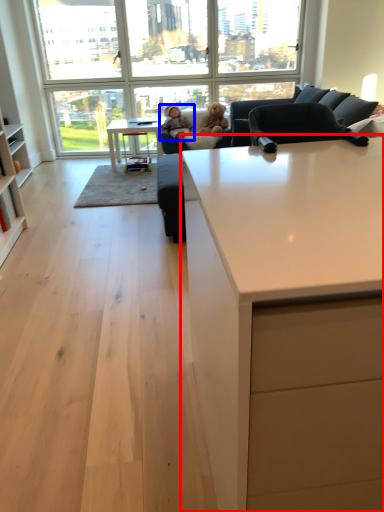
Question: Which object appears farthest to the camera in this image, countertop (highlighted by a red box) or person (highlighted by a blue box)?

Choices:
 (A) countertop
 (B) person

Answer: (B)